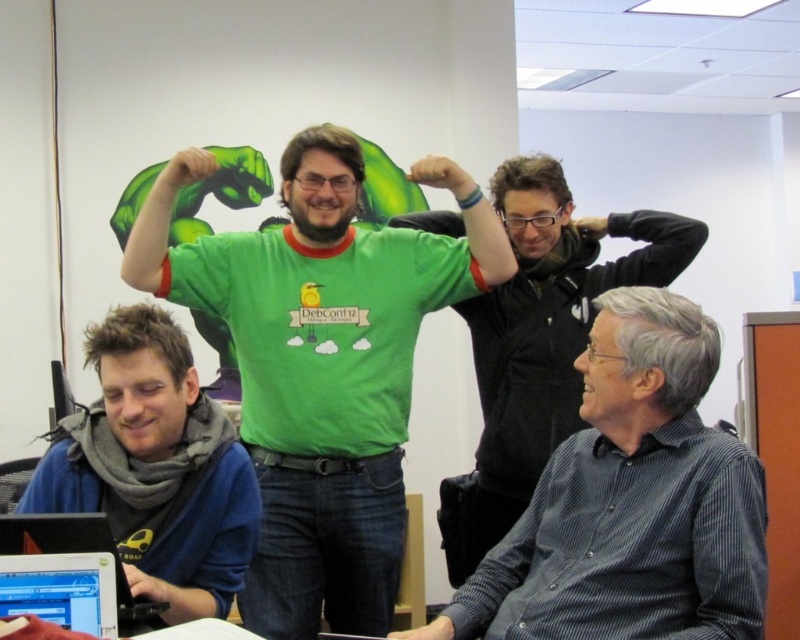
Between black glossy laptop at lower left and black matte arm at upper right, which one has more height?

With more height is black matte arm at upper right.

Is black glossy laptop at lower left to the right of black matte arm at upper right from the viewer's perspective?

Incorrect, black glossy laptop at lower left is not on the right side of black matte arm at upper right.

Does point (57, 618) lie behind point (612, 278)?

No, it is not.

Locate an element on the screen. black glossy laptop at lower left is located at coordinates (61, 589).

Who is higher up, striped cotton shirt at right or silver metallic laptop at lower left?

striped cotton shirt at right is above.

Between striped cotton shirt at right and silver metallic laptop at lower left, which one appears on the right side from the viewer's perspective?

striped cotton shirt at right

Who is more distant from viewer, (516, 232) or (12, 540)?

The point (516, 232) is more distant.

Locate an element on the screen. The image size is (800, 640). striped cotton shirt at right is located at coordinates (540, 342).

Which of these two, green fabric hand at upper center or matte black hand at upper center, stands taller?

green fabric hand at upper center

Who is shorter, green fabric hand at upper center or matte black hand at upper center?

matte black hand at upper center

Which is behind, point (168, 161) or point (588, 227)?

The point (168, 161) is behind.

At what (x,y) coordinates should I click in order to perform the action: click on green fabric hand at upper center. Please return your answer as a coordinate pair (x, y). Looking at the image, I should click on (186, 168).